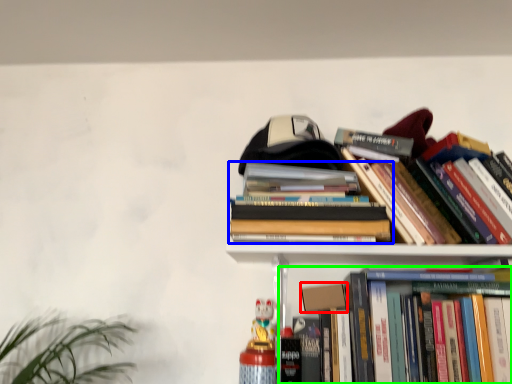
Question: Based on their relative distances, which object is farther from paperback book (highlighted by a red box)? Choose from book (highlighted by a blue box) and book (highlighted by a green box).

Choices:
 (A) book
 (B) book

Answer: (A)